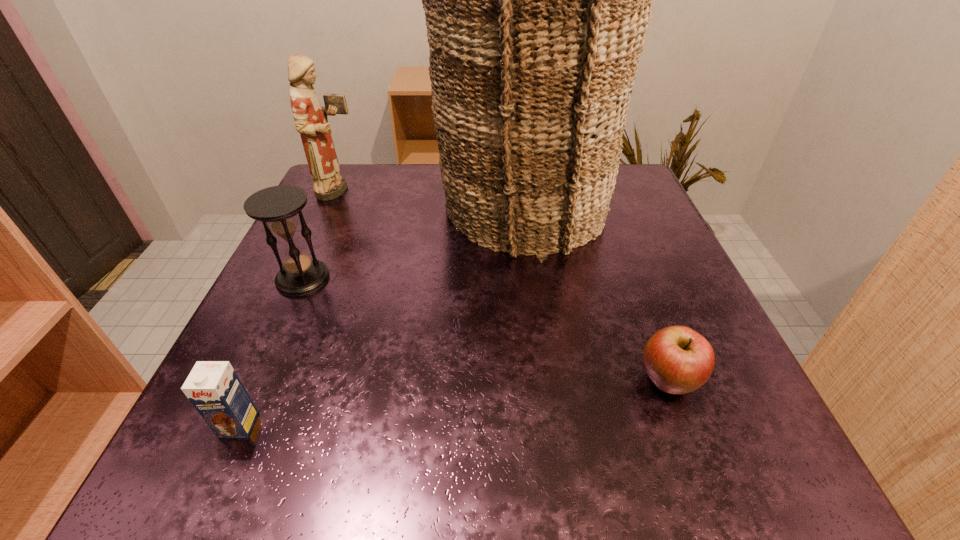
Locate an element on the screen. the tallest object is located at coordinates (537, 0).

This screenshot has height=540, width=960. In order to click on the second tallest object in this screenshot , I will do point(311,121).

At what (x,y) coordinates should I click in order to perform the action: click on hourglass. Please return your answer as a coordinate pair (x, y). The height and width of the screenshot is (540, 960). Looking at the image, I should click on (277, 207).

This screenshot has width=960, height=540. Identify the location of the nearest object. (213, 387).

The height and width of the screenshot is (540, 960). I want to click on the second nearest object, so click(x=678, y=360).

The width and height of the screenshot is (960, 540). Find the location of `vacant space located 0.320m on the front of the basket`. vacant space located 0.320m on the front of the basket is located at coordinates (548, 417).

Where is `free space located on the front-facing side of the figurine`? The width and height of the screenshot is (960, 540). free space located on the front-facing side of the figurine is located at coordinates (512, 191).

Locate an element on the screen. The image size is (960, 540). vacant region located 0.290m on the right of the third tallest object is located at coordinates (490, 278).

Where is `free space located 0.060m on the front label of the chocolate milk`? The height and width of the screenshot is (540, 960). free space located 0.060m on the front label of the chocolate milk is located at coordinates coord(212,485).

This screenshot has width=960, height=540. What are the coordinates of `free spot located on the left of the apple` in the screenshot? It's located at (588, 382).